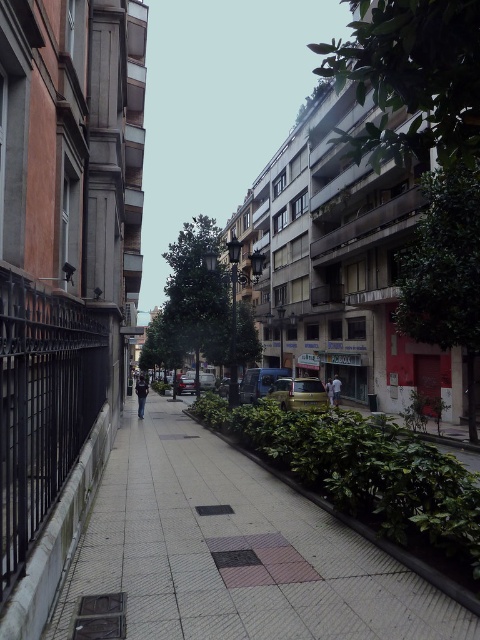
Looking at this image, who is shorter, gray concrete sidewalk at center or light blue denim jacket at center?

With less height is light blue denim jacket at center.

Is gray concrete sidewalk at center positioned before light blue denim jacket at center?

That is True.

Does point (379, 609) lie behind point (332, 401)?

No, it is not.

You are a GUI agent. You are given a task and a screenshot of the screen. Output one action in this format:
    pyautogui.click(x=<x>, y=<y>)
    Task: Click on the gray concrete sidewalk at center
    
    Given the screenshot: What is the action you would take?
    pyautogui.click(x=233, y=550)

Does denim jacket at center have a lesser height compared to light blue denim jacket at center?

In fact, denim jacket at center may be taller than light blue denim jacket at center.

Based on the photo, is denim jacket at center taller than light blue denim jacket at center?

Correct, denim jacket at center is much taller as light blue denim jacket at center.

Is point (137, 394) behind point (337, 392)?

That is False.

Image resolution: width=480 pixels, height=640 pixels. In order to click on denim jacket at center in this screenshot , I will do `click(141, 394)`.

Can you confirm if gray concrete sidewalk at center is positioned above denim jacket at center?

Indeed, gray concrete sidewalk at center is positioned over denim jacket at center.

Image resolution: width=480 pixels, height=640 pixels. What do you see at coordinates (233, 550) in the screenshot?
I see `gray concrete sidewalk at center` at bounding box center [233, 550].

This screenshot has height=640, width=480. In order to click on gray concrete sidewalk at center in this screenshot , I will do `click(233, 550)`.